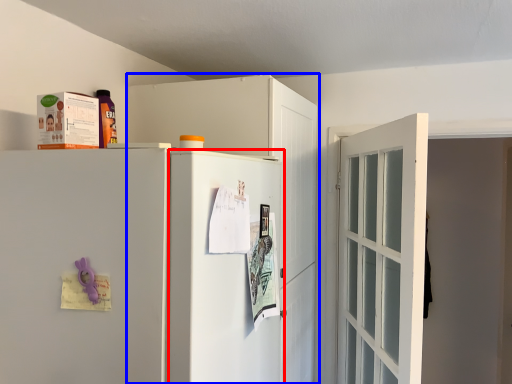
Question: Which object appears farthest to the camera in this image, screen door (highlighted by a red box) or cabinetry (highlighted by a blue box)?

Choices:
 (A) screen door
 (B) cabinetry

Answer: (B)